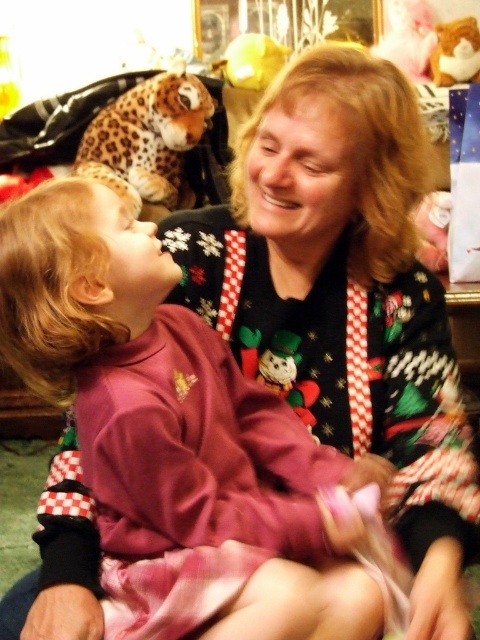
You are a toy collector who wants to place the plush snowman at center and the fluffy plush bear at upper right on a shelf. The shelf has a maximum length of 6 feet. Can both toys fit side by side on the shelf without overlapping?

The plush snowman at center and the fluffy plush bear at upper right are 6.14 feet apart from each other. Since the distance between them is greater than the shelf length of 6 feet, they cannot fit side by side on the shelf without overlapping.

You are a photographer standing 40 inches away from the plush snowman at center. Can you take a clear photo of it without moving closer?

The plush snowman at center is 37.61 inches away from the camera. Since you are standing 40 inches away, you are slightly farther than the snowman. To take a clear photo, you need to move closer to ensure you are within the minimum focus distance required for clarity.